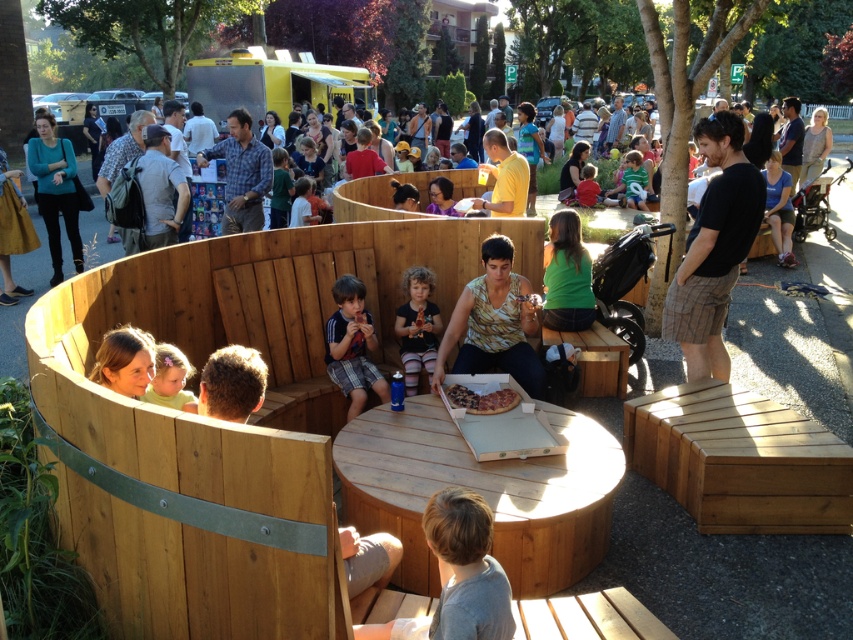
Question: In this image, where is striped t-shirt at center located relative to matte black shirt at center?

Choices:
 (A) right
 (B) left

Answer: (B)

Question: Which object is positioned closest to the striped t-shirt at center?

Choices:
 (A) matte black shirt at center
 (B) wooden table at center

Answer: (A)

Question: Can you confirm if wooden table at center is positioned above striped t-shirt at center?

Choices:
 (A) yes
 (B) no

Answer: (B)

Question: Is striped t-shirt at center to the right of matte black shirt at center from the viewer's perspective?

Choices:
 (A) no
 (B) yes

Answer: (A)

Question: Which of the following is the closest to the observer?

Choices:
 (A) (416, 348)
 (B) (601, 476)

Answer: (B)

Question: Which point is closer to the camera?

Choices:
 (A) (192, 401)
 (B) (369, 488)

Answer: (A)